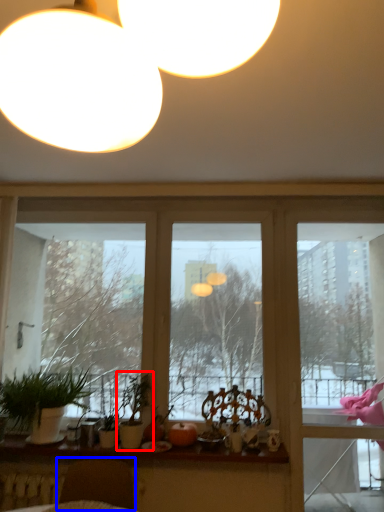
Question: Which point is closer to the camera, houseplant (highlighted by a red box) or swivel chair (highlighted by a blue box)?

Choices:
 (A) houseplant
 (B) swivel chair

Answer: (B)